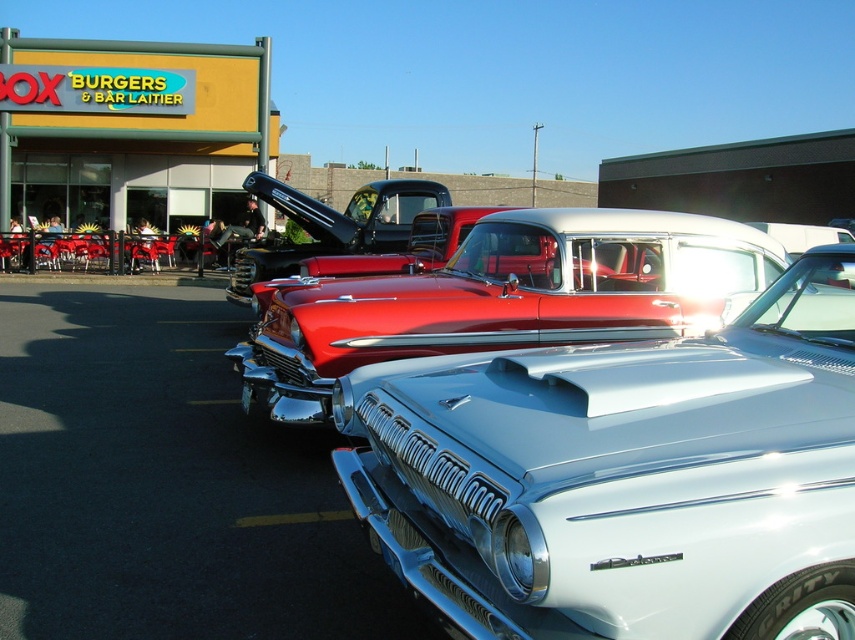
Who is shorter, metallic silver car at center or shiny red pickup truck at center?

Standing shorter between the two is metallic silver car at center.

Is point (782, 332) behind point (417, 240)?

No, it is in front of (417, 240).

What are the coordinates of `metallic silver car at center` in the screenshot? It's located at (624, 476).

Is metallic silver car at center bigger than yellow sign at upper left?

No, metallic silver car at center is not bigger than yellow sign at upper left.

In the scene shown: Who is positioned more to the right, metallic silver car at center or yellow sign at upper left?

metallic silver car at center is more to the right.

Describe the element at coordinates (624, 476) in the screenshot. I see `metallic silver car at center` at that location.

This screenshot has width=855, height=640. I want to click on metallic silver car at center, so click(x=624, y=476).

Between glossy red pickup truck at center and shiny red pickup truck at center, which one appears on the right side from the viewer's perspective?

A: glossy red pickup truck at center is more to the right.

Is glossy red pickup truck at center bigger than shiny red pickup truck at center?

Actually, glossy red pickup truck at center might be smaller than shiny red pickup truck at center.

Which is behind, point (363, 285) or point (405, 256)?

Point (405, 256)

This screenshot has height=640, width=855. What are the coordinates of `glossy red pickup truck at center` in the screenshot? It's located at (506, 298).